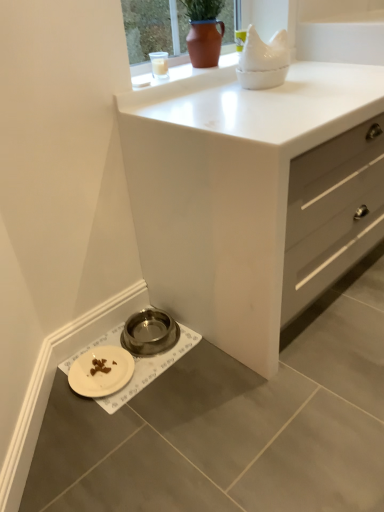
In order to click on metallic bowl at lower left in this screenshot , I will do `click(149, 332)`.

What do you see at coordinates (149, 332) in the screenshot?
I see `metallic bowl at lower left` at bounding box center [149, 332].

Where is `white matte plate at lower left`? Image resolution: width=384 pixels, height=512 pixels. white matte plate at lower left is located at coordinates (101, 371).

Where is `chest of drawers above the white matte plate at lower left (from a real-world perspective)`? The image size is (384, 512). chest of drawers above the white matte plate at lower left (from a real-world perspective) is located at coordinates (252, 194).

Does white matte plate at lower left appear on the left side of white matte chest of drawers at center?

Yes, white matte plate at lower left is to the left of white matte chest of drawers at center.

Is white matte plate at lower left with white matte chest of drawers at center?

No, white matte plate at lower left is not in contact with white matte chest of drawers at center.

From a real-world perspective, is white matte plate at lower left below metallic bowl at lower left?

Actually, white matte plate at lower left is physically above metallic bowl at lower left in the real world.

Can you confirm if white matte plate at lower left is shorter than metallic bowl at lower left?

Yes, white matte plate at lower left is shorter than metallic bowl at lower left.

Considering the relative sizes of metallic bowl at lower left and matte brown pot at upper center in the image provided, is metallic bowl at lower left smaller than matte brown pot at upper center?

Correct, metallic bowl at lower left occupies less space than matte brown pot at upper center.

Which point is more distant from viewer, (160, 341) or (141, 50)?

Point (160, 341)

I want to click on window frame located on the right of metallic bowl at lower left, so click(x=155, y=31).

In the scene shown: Which object is positioned more to the right, metallic bowl at lower left or matte brown pot at upper center?

matte brown pot at upper center is more to the right.

Is point (361, 201) farther from camera compared to point (152, 374)?

That is True.

Is white matte chest of drawers at center in contact with white matte pet bowl at lower left?

white matte chest of drawers at center and white matte pet bowl at lower left are not in contact.

In the scene shown: From a real-world perspective, is white matte chest of drawers at center physically located above or below white matte pet bowl at lower left?

Clearly, from a real-world perspective, white matte chest of drawers at center is above white matte pet bowl at lower left.

Which of these two, metallic bowl at lower left or white matte pet bowl at lower left, is thinner?

Thinner between the two is metallic bowl at lower left.

From the image's perspective, which one is positioned higher, metallic bowl at lower left or white matte pet bowl at lower left?

metallic bowl at lower left appears higher in the image.

What's the angular difference between metallic bowl at lower left and white matte pet bowl at lower left's facing directions?

There is a 0.000951-degree angle between the facing directions of metallic bowl at lower left and white matte pet bowl at lower left.

Considering the points (156, 317) and (145, 360), which point is in front, point (156, 317) or point (145, 360)?

Positioned in front is point (145, 360).

Which is farther from the camera, (x=123, y=9) or (x=132, y=368)?

Positioned behind is point (x=132, y=368).

From the image's perspective, is matte brown pot at upper center positioned above or below white matte plate at lower left?

Based on their image positions, matte brown pot at upper center is located above white matte plate at lower left.

Who is taller, matte brown pot at upper center or white matte plate at lower left?

Standing taller between the two is matte brown pot at upper center.

Measure the distance between matte brown pot at upper center and white matte plate at lower left.

A distance of 1.09 meters exists between matte brown pot at upper center and white matte plate at lower left.

Which object is further away from the camera taking this photo, white matte chest of drawers at center or metallic bowl at lower left?

metallic bowl at lower left is behind.

Considering the positions of objects white matte chest of drawers at center and metallic bowl at lower left in the image provided, who is more to the left, white matte chest of drawers at center or metallic bowl at lower left?

From the viewer's perspective, metallic bowl at lower left appears more on the left side.

How far apart are white matte chest of drawers at center and metallic bowl at lower left?

21.22 inches.

Looking at this image, from the image's perspective, is white matte chest of drawers at center below metallic bowl at lower left?

Incorrect, from the image's perspective, white matte chest of drawers at center is higher than metallic bowl at lower left.

What are the coordinates of `the chest of drawers lying above the white matte plate at lower left (from the image's perspective)` in the screenshot? It's located at (252, 194).

Image resolution: width=384 pixels, height=512 pixels. What are the coordinates of `appliance to the right of white matte plate at lower left` in the screenshot? It's located at (149, 332).

Which object lies nearer to the anchor point white matte plate at lower left, white matte pet bowl at lower left or white matte chest of drawers at center?

Based on the image, white matte pet bowl at lower left appears to be nearer to white matte plate at lower left.

Looking at the image, which one is located further to white matte pet bowl at lower left, white matte plate at lower left or metallic bowl at lower left?

The object further to white matte pet bowl at lower left is metallic bowl at lower left.

Looking at the image, which one is located further to white matte pet bowl at lower left, metallic bowl at lower left or matte brown pot at upper center?

matte brown pot at upper center is further to white matte pet bowl at lower left.

Looking at the image, which one is located closer to white matte pet bowl at lower left, white matte chest of drawers at center or white matte plate at lower left?

white matte plate at lower left is closer to white matte pet bowl at lower left.

When comparing their distances from matte brown pot at upper center, does metallic bowl at lower left or white matte pet bowl at lower left seem further?

white matte pet bowl at lower left.

Based on the photo, considering their positions, is matte brown pot at upper center positioned further to white matte plate at lower left than white matte pet bowl at lower left?

Based on the image, matte brown pot at upper center appears to be further to white matte plate at lower left.

Which object lies further to the anchor point metallic bowl at lower left, white matte pet bowl at lower left or white matte plate at lower left?

white matte plate at lower left.

Considering their positions, is matte brown pot at upper center positioned further to white matte pet bowl at lower left than white matte chest of drawers at center?

Among the two, matte brown pot at upper center is located further to white matte pet bowl at lower left.

This screenshot has height=512, width=384. Identify the location of chest of drawers between matte brown pot at upper center and metallic bowl at lower left in the up-down direction. (252, 194).

You are a GUI agent. You are given a task and a screenshot of the screen. Output one action in this format:
    pyautogui.click(x=<x>, y=<y>)
    Task: Click on the sink between white matte plate at lower left and white matte chest of drawers at center in the horizontal direction
    The height and width of the screenshot is (512, 384).
    Given the screenshot: What is the action you would take?
    pyautogui.click(x=150, y=370)

In order to click on the chest of drawers that lies between matte brown pot at upper center and white matte pet bowl at lower left from top to bottom in this screenshot , I will do `click(252, 194)`.

You are a GUI agent. You are given a task and a screenshot of the screen. Output one action in this format:
    pyautogui.click(x=<x>, y=<y>)
    Task: Click on the sink that lies between matte brown pot at upper center and white matte plate at lower left from top to bottom
    The image size is (384, 512).
    Given the screenshot: What is the action you would take?
    pyautogui.click(x=150, y=370)